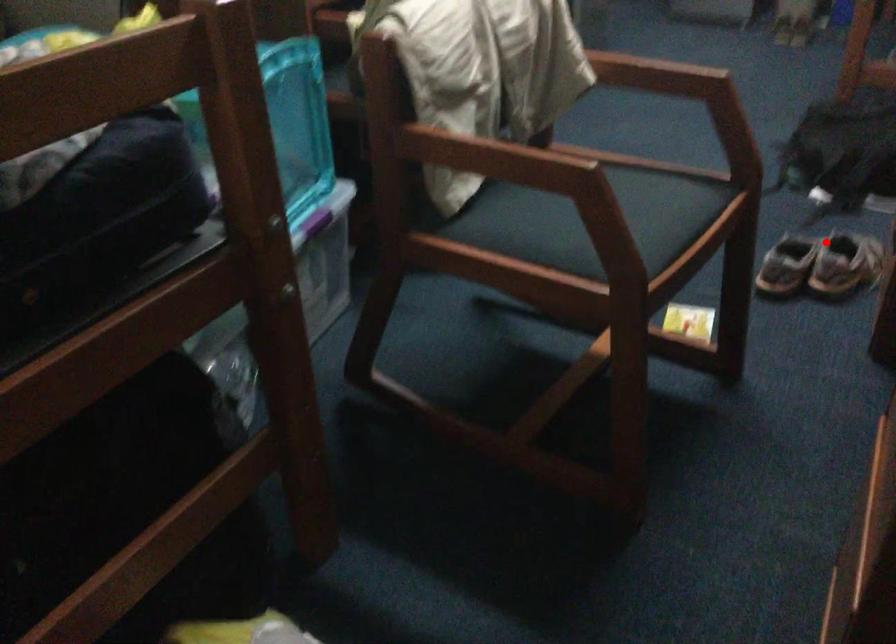
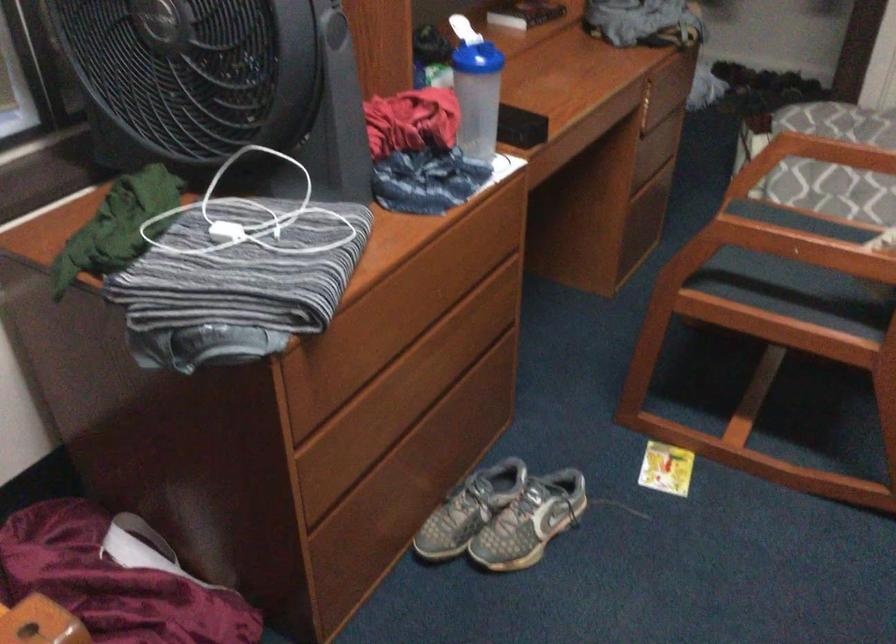
Find the pixel in the second image that matches the highlighted location in the first image.

(503, 516)